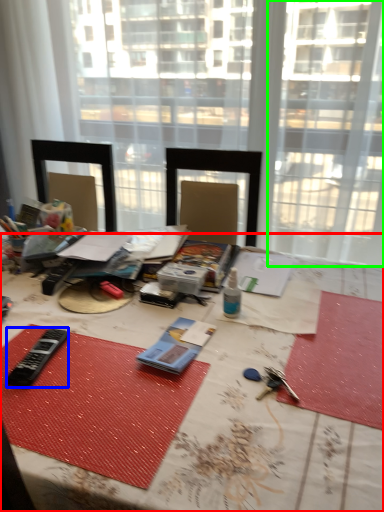
Question: Estimate the real-world distances between objects in this image. Which object is closer to table (highlighted by a red box), equipment (highlighted by a blue box) or window (highlighted by a green box)?

Choices:
 (A) equipment
 (B) window

Answer: (A)